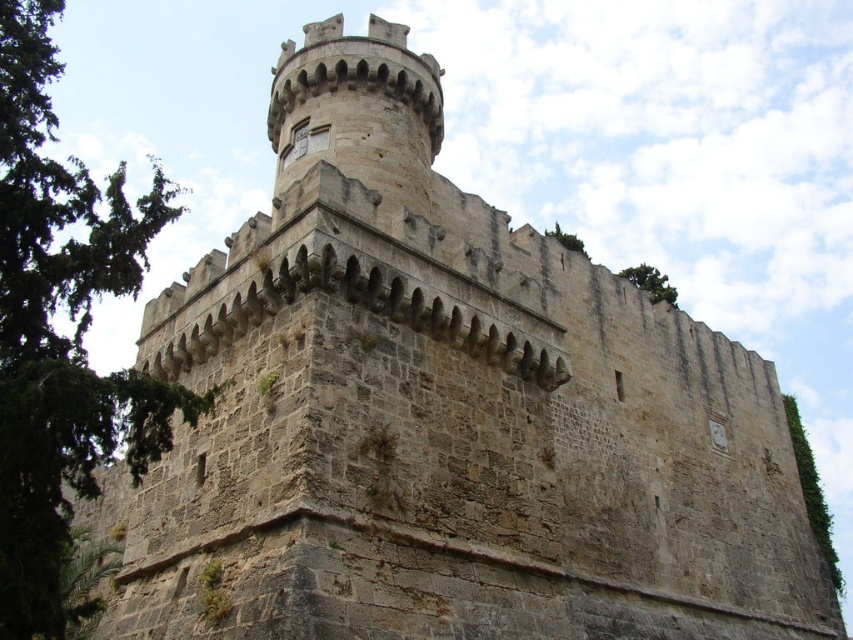
Question: Is green leafy tree at left below green leafy tree at lower right?

Choices:
 (A) no
 (B) yes

Answer: (A)

Question: Is green leafy tree at upper right positioned behind green leafy tree at upper center?

Choices:
 (A) yes
 (B) no

Answer: (A)

Question: Which point appears closest to the camera in this image?

Choices:
 (A) (48, 576)
 (B) (819, 486)
 (C) (575, 243)
 (D) (660, 282)

Answer: (A)

Question: Can you confirm if green leafy tree at upper right is positioned to the left of green leafy tree at upper center?

Choices:
 (A) yes
 (B) no

Answer: (B)

Question: Which point is closer to the camera?

Choices:
 (A) (556, 240)
 (B) (157, 458)
 (C) (650, 284)

Answer: (B)

Question: Among these points, which one is nearest to the camera?

Choices:
 (A) (90, 426)
 (B) (663, 280)
 (C) (828, 545)

Answer: (A)